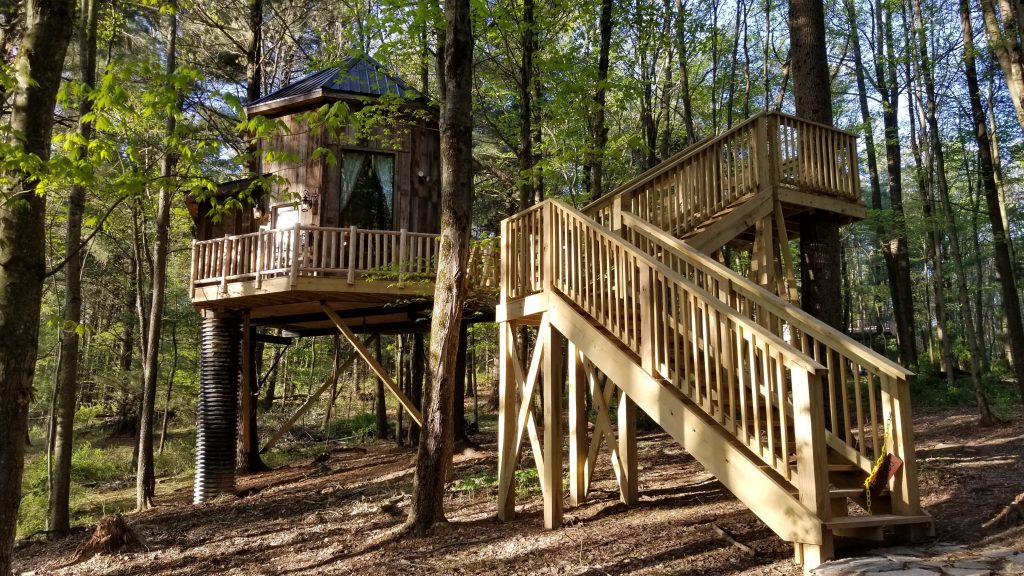
The height and width of the screenshot is (576, 1024). Find the location of `stairway`. stairway is located at coordinates (725, 406), (707, 211).